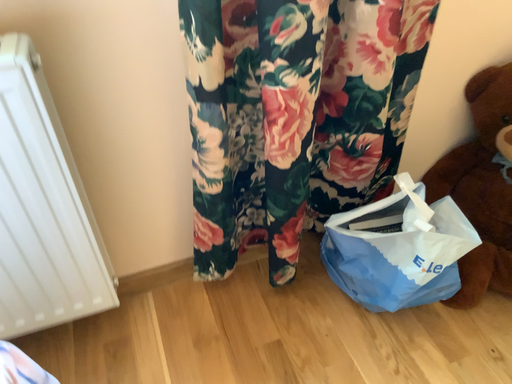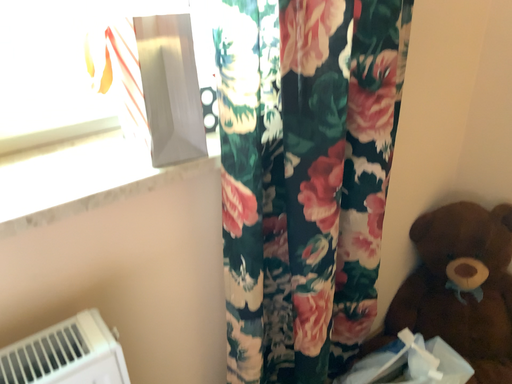
Question: How did the camera likely rotate when shooting the video?

Choices:
 (A) rotated right
 (B) rotated left

Answer: (A)